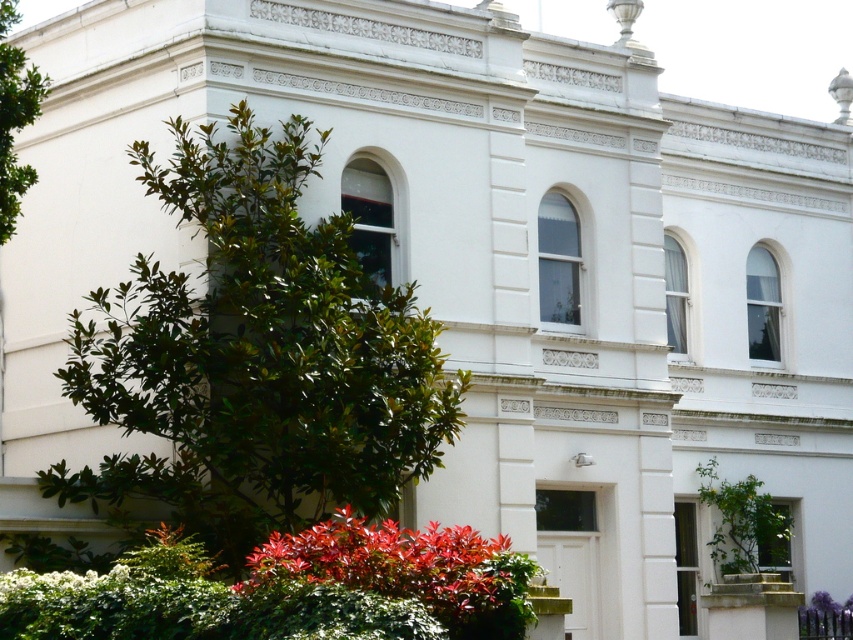
From the picture: Is shiny red leaves at lower center taller than green leafy tree at left?

Correct, shiny red leaves at lower center is much taller as green leafy tree at left.

What do you see at coordinates (402, 564) in the screenshot?
I see `shiny red leaves at lower center` at bounding box center [402, 564].

What do you see at coordinates (402, 564) in the screenshot? This screenshot has width=853, height=640. I see `shiny red leaves at lower center` at bounding box center [402, 564].

The width and height of the screenshot is (853, 640). I want to click on shiny red leaves at lower center, so click(x=402, y=564).

Between green leafy tree at center and green leafy tree at left, which one has less height?

With less height is green leafy tree at left.

Locate an element on the screen. Image resolution: width=853 pixels, height=640 pixels. green leafy tree at center is located at coordinates (254, 356).

Can you confirm if green leafy tree at center is taller than shiny red leaves at lower center?

Yes.

The height and width of the screenshot is (640, 853). Describe the element at coordinates (254, 356) in the screenshot. I see `green leafy tree at center` at that location.

Where is `green leafy tree at center`? The height and width of the screenshot is (640, 853). green leafy tree at center is located at coordinates (254, 356).